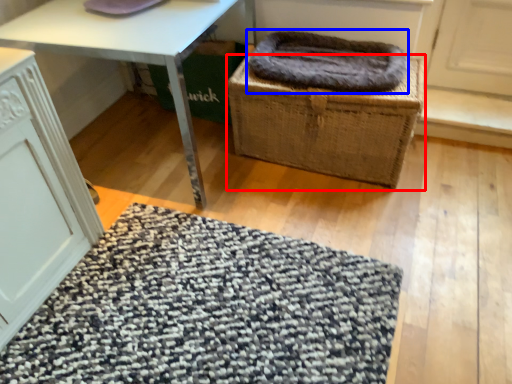
Question: Among these objects, which one is farthest to the camera, basket (highlighted by a red box) or blanket (highlighted by a blue box)?

Choices:
 (A) basket
 (B) blanket

Answer: (B)